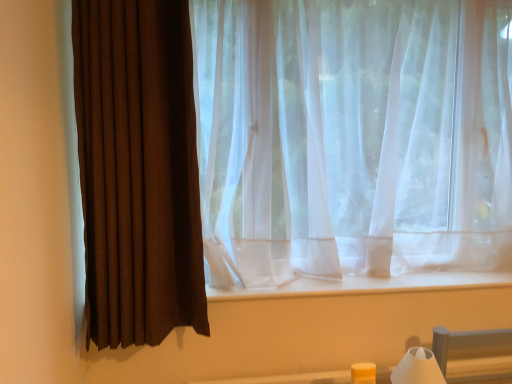
The height and width of the screenshot is (384, 512). What do you see at coordinates (138, 170) in the screenshot?
I see `brown fabric curtain at left` at bounding box center [138, 170].

I want to click on brown fabric curtain at left, so click(138, 170).

Identify the location of white matte table lamp at lower right. (418, 368).

Describe the element at coordinates (418, 368) in the screenshot. I see `white matte table lamp at lower right` at that location.

Locate an element on the screen. The image size is (512, 384). brown fabric curtain at left is located at coordinates (138, 170).

Can you confirm if brown fabric curtain at left is positioned to the right of white matte table lamp at lower right?

In fact, brown fabric curtain at left is to the left of white matte table lamp at lower right.

Does brown fabric curtain at left come behind white matte table lamp at lower right?

No, it is in front of white matte table lamp at lower right.

Does point (193, 325) appear closer or farther from the camera than point (416, 363)?

Point (193, 325).

From the image's perspective, is brown fabric curtain at left on top of white matte table lamp at lower right?

Yes, from the image's perspective, brown fabric curtain at left is above white matte table lamp at lower right.

From a real-world perspective, relative to white matte table lamp at lower right, is brown fabric curtain at left vertically above or below?

In terms of real-world spatial position, brown fabric curtain at left is above white matte table lamp at lower right.

Which object is wider, brown fabric curtain at left or white matte table lamp at lower right?

brown fabric curtain at left.

From their relative heights in the image, would you say brown fabric curtain at left is taller or shorter than white matte table lamp at lower right?

Considering their sizes, brown fabric curtain at left has more height than white matte table lamp at lower right.

Is brown fabric curtain at left bigger than white matte table lamp at lower right?

Indeed, brown fabric curtain at left has a larger size compared to white matte table lamp at lower right.

In the scene shown: Would you say brown fabric curtain at left contains white matte table lamp at lower right?

Actually, white matte table lamp at lower right is outside brown fabric curtain at left.

Can you see brown fabric curtain at left touching white matte table lamp at lower right?

brown fabric curtain at left and white matte table lamp at lower right are clearly separated.

Is brown fabric curtain at left oriented away from white matte table lamp at lower right?

No.

Looking at this image, what's the angular difference between brown fabric curtain at left and white matte table lamp at lower right's facing directions?

They differ by 1.08 degrees in their facing directions.

Measure the distance from brown fabric curtain at left to white matte table lamp at lower right.

36.65 inches.

Locate an element on the screen. The width and height of the screenshot is (512, 384). curtain in front of the white matte table lamp at lower right is located at coordinates 138,170.

Is white matte table lamp at lower right at the right side of brown fabric curtain at left?

Indeed, white matte table lamp at lower right is positioned on the right side of brown fabric curtain at left.

In the image, is white matte table lamp at lower right positioned in front of or behind brown fabric curtain at left?

In the image, white matte table lamp at lower right appears behind brown fabric curtain at left.

Is point (418, 367) closer to viewer compared to point (140, 8)?

No, (418, 367) is behind (140, 8).

From the image's perspective, which is below, white matte table lamp at lower right or brown fabric curtain at left?

white matte table lamp at lower right.

From a real-world perspective, is white matte table lamp at lower right on brown fabric curtain at left?

No, from a real-world perspective, white matte table lamp at lower right is not over brown fabric curtain at left

Considering the sizes of white matte table lamp at lower right and brown fabric curtain at left in the image, is white matte table lamp at lower right wider or thinner than brown fabric curtain at left?

Clearly, white matte table lamp at lower right has less width compared to brown fabric curtain at left.

Can you confirm if white matte table lamp at lower right is shorter than brown fabric curtain at left?

Correct, white matte table lamp at lower right is not as tall as brown fabric curtain at left.

In the scene shown: Does white matte table lamp at lower right have a larger size compared to brown fabric curtain at left?

No, white matte table lamp at lower right is not bigger than brown fabric curtain at left.

Can we say white matte table lamp at lower right lies outside brown fabric curtain at left?

white matte table lamp at lower right lies outside brown fabric curtain at left's area.

Does white matte table lamp at lower right touch brown fabric curtain at left?

No.

Is white matte table lamp at lower right aimed at brown fabric curtain at left?

No, white matte table lamp at lower right is not facing towards brown fabric curtain at left.

How many degrees apart are the facing directions of white matte table lamp at lower right and brown fabric curtain at left?

1.08 degrees separate the facing orientations of white matte table lamp at lower right and brown fabric curtain at left.

Find the location of a particular element. The height and width of the screenshot is (384, 512). curtain that is above the white matte table lamp at lower right (from a real-world perspective) is located at coordinates (138, 170).

Locate an element on the screen. This screenshot has width=512, height=384. table lamp that appears below the brown fabric curtain at left (from a real-world perspective) is located at coordinates (418, 368).

Image resolution: width=512 pixels, height=384 pixels. In order to click on curtain located in front of the white matte table lamp at lower right in this screenshot , I will do `click(138, 170)`.